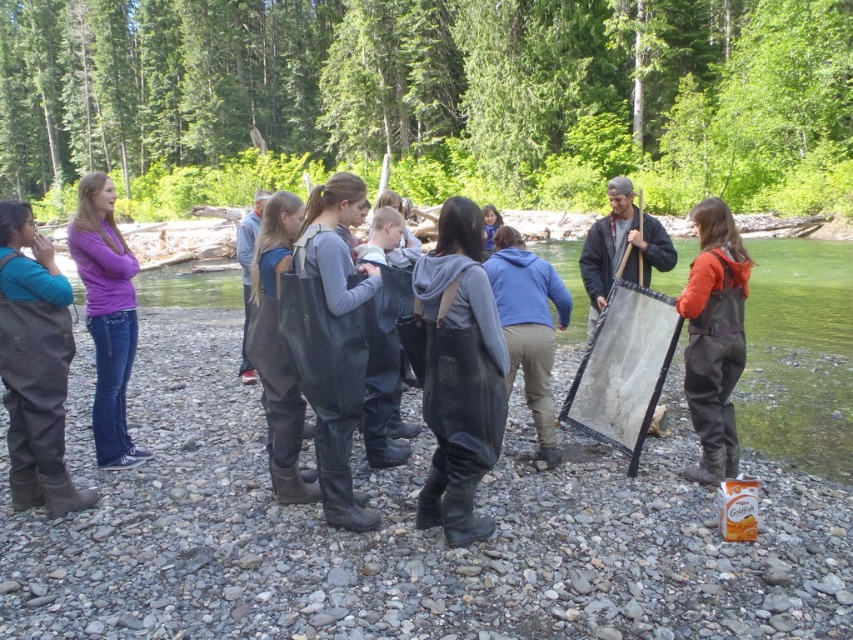
Question: From the image, what is the correct spatial relationship of orange waterproof overalls at center in relation to blue fleece jacket at center?

Choices:
 (A) above
 (B) below

Answer: (A)

Question: Observing the image, what is the correct spatial positioning of brown leather boots at left in reference to purple softshell jacket at left?

Choices:
 (A) below
 (B) above

Answer: (A)

Question: Observing the image, what is the correct spatial positioning of brown leather boots at left in reference to blue fleece jacket at center?

Choices:
 (A) left
 (B) right

Answer: (A)

Question: Which object is positioned farthest from the orange waterproof overalls at center?

Choices:
 (A) purple softshell jacket at left
 (B) brown leather boots at left
 (C) blue fleece jacket at center
 (D) dark gray rubber waders at center

Answer: (A)

Question: Which object is the closest to the brown leather boots at left?

Choices:
 (A) dark gray rubber waders at center
 (B) purple softshell jacket at left
 (C) blue fleece jacket at center

Answer: (B)

Question: Which object is closer to the camera taking this photo?

Choices:
 (A) purple softshell jacket at left
 (B) blue fleece jacket at center
 (C) orange waterproof overalls at center
 (D) dark gray rubber waders at center

Answer: (D)